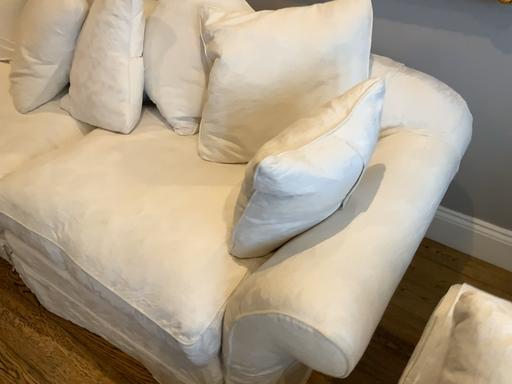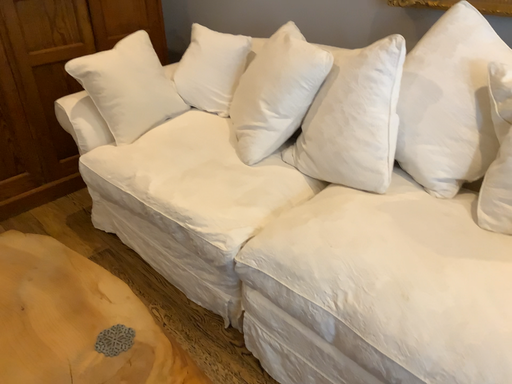
Question: How did the camera likely rotate when shooting the video?

Choices:
 (A) rotated right
 (B) rotated left

Answer: (B)